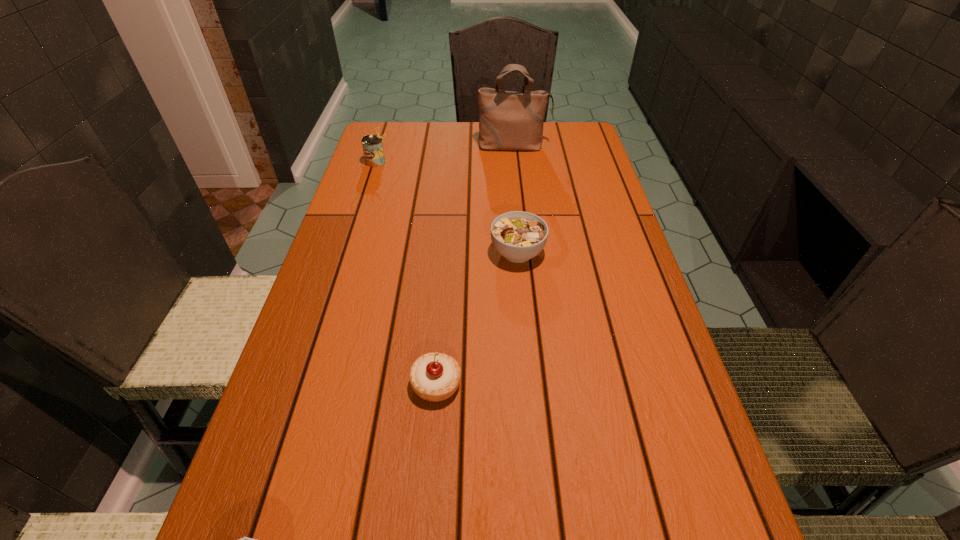
Locate an element on the screen. The height and width of the screenshot is (540, 960). object that stands as the fourth closest to the taller soup bowl is located at coordinates (245, 539).